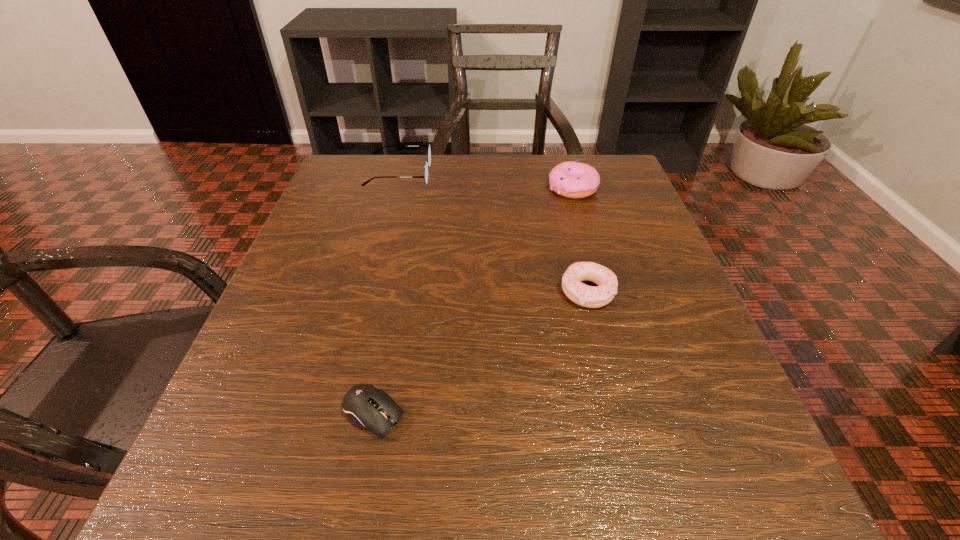
You are a GUI agent. You are given a task and a screenshot of the screen. Output one action in this format:
    pyautogui.click(x=<x>, y=<y>)
    Task: Click on the doughnut situated at the far edge
    The height and width of the screenshot is (540, 960).
    Given the screenshot: What is the action you would take?
    pyautogui.click(x=575, y=180)

What are the coordinates of `object that is positioned at the left edge` in the screenshot? It's located at (428, 163).

Locate an element on the screen. This screenshot has width=960, height=540. object present at the far left corner is located at coordinates (428, 163).

Identify the location of object that is at the far right corner. (575, 180).

Image resolution: width=960 pixels, height=540 pixels. What are the coordinates of `free space at the far edge of the desktop` in the screenshot? It's located at (506, 208).

In the image, there is a desktop. Identify the location of free space at the near edge. (395, 463).

What are the coordinates of `vacant space at the left edge` in the screenshot? It's located at (368, 264).

Where is `free space at the right edge of the desktop`? The image size is (960, 540). free space at the right edge of the desktop is located at coordinates (691, 352).

In the image, there is a desktop. Find the location of `blank space at the far left corner`. blank space at the far left corner is located at coordinates (323, 201).

Image resolution: width=960 pixels, height=540 pixels. In the image, there is a desktop. Find the location of `vacant space at the far right corner`. vacant space at the far right corner is located at coordinates (607, 183).